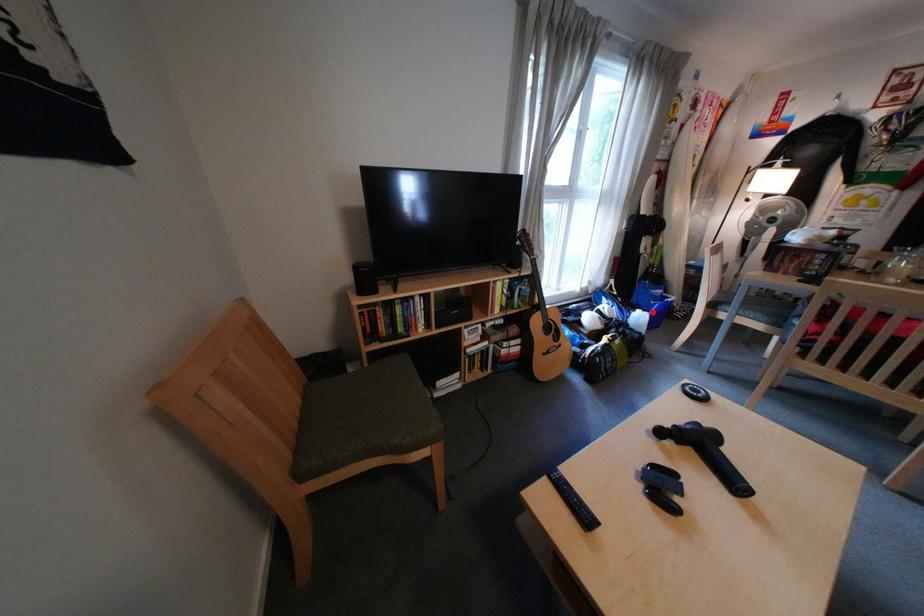
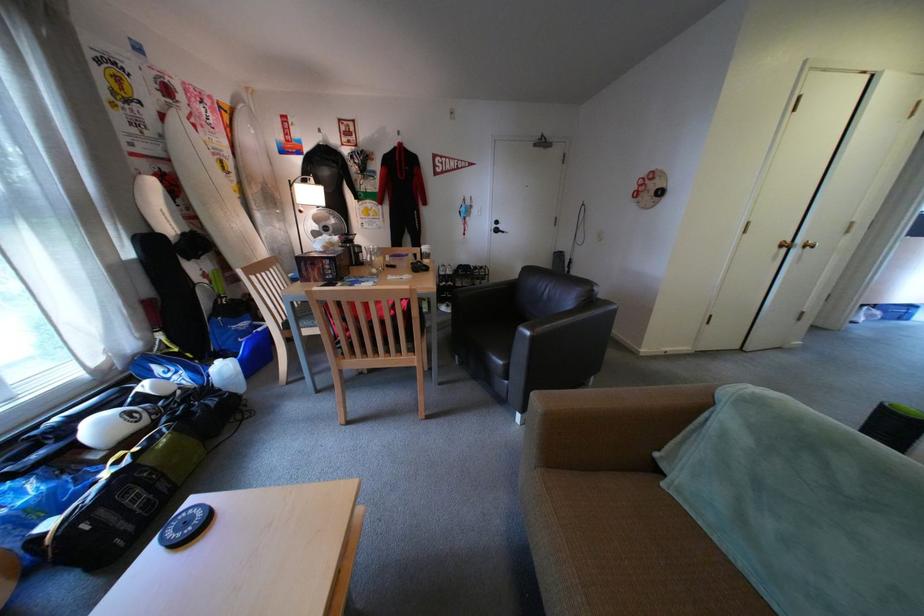
Where in the second image is the point corresponding to the highlighted location from the first image?

(233, 363)